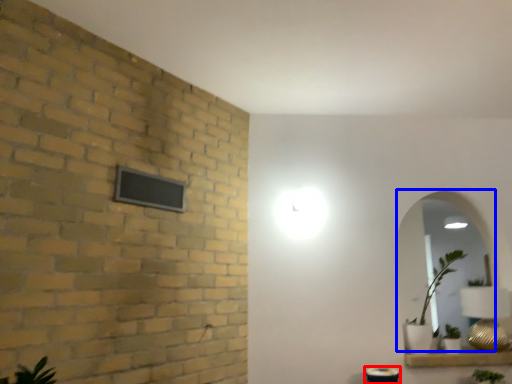
Question: Among these objects, which one is nearest to the camera, table (highlighted by a red box) or mirror (highlighted by a blue box)?

Choices:
 (A) table
 (B) mirror

Answer: (A)